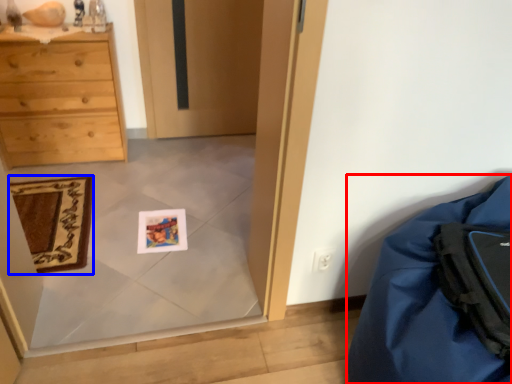
Question: Which object is further to the camera taking this photo, furniture (highlighted by a red box) or mat (highlighted by a blue box)?

Choices:
 (A) furniture
 (B) mat

Answer: (B)